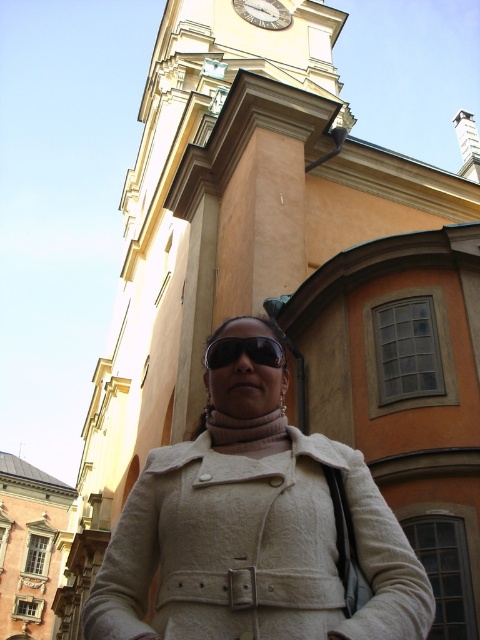
Question: Estimate the real-world distances between objects in this image. Which object is farther from the white woolen coat at center?

Choices:
 (A) metallic clock face at upper center
 (B) black reflective sunglasses at center

Answer: (A)

Question: Is black reflective sunglasses at center bigger than metallic clock face at upper center?

Choices:
 (A) yes
 (B) no

Answer: (B)

Question: Which point appears farthest from the camera in this image?

Choices:
 (A) (337, 593)
 (B) (256, 8)

Answer: (B)

Question: Which of these objects is positioned farthest from the white woolen coat at center?

Choices:
 (A) metallic clock face at upper center
 (B) black reflective sunglasses at center

Answer: (A)

Question: Does white woolen coat at center appear over black reflective sunglasses at center?

Choices:
 (A) no
 (B) yes

Answer: (A)

Question: Does white woolen coat at center have a smaller size compared to black reflective sunglasses at center?

Choices:
 (A) yes
 (B) no

Answer: (B)